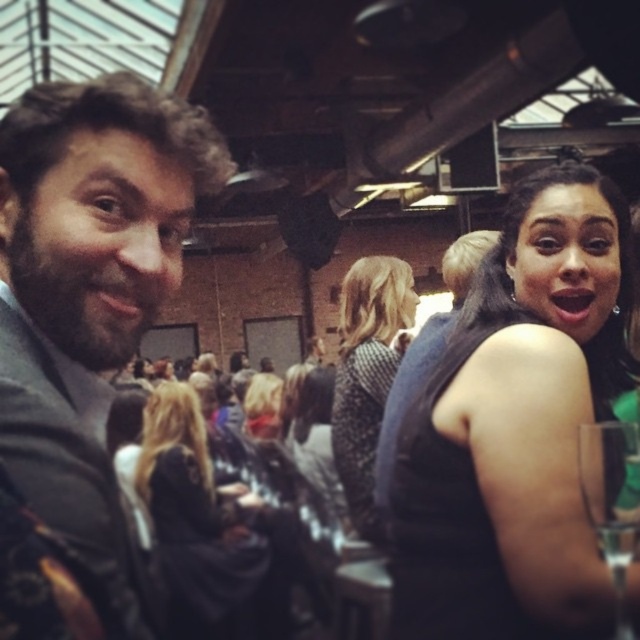
Who is taller, dark gray suit at left or black matte dress at upper right?

black matte dress at upper right

Does dark gray suit at left appear under black matte dress at upper right?

Actually, dark gray suit at left is above black matte dress at upper right.

The image size is (640, 640). What do you see at coordinates (83, 333) in the screenshot? I see `dark gray suit at left` at bounding box center [83, 333].

This screenshot has height=640, width=640. What are the coordinates of `dark gray suit at left` in the screenshot? It's located at (83, 333).

Between black matte dress at upper right and black fabric dress at upper right, which one is positioned lower?

Positioned lower is black matte dress at upper right.

In the scene shown: Who is more forward, (476, 433) or (410, 387)?

Point (476, 433) is in front.

At what (x,y) coordinates should I click in order to perform the action: click on black matte dress at upper right. Please return your answer as a coordinate pair (x, y). Image resolution: width=640 pixels, height=640 pixels. Looking at the image, I should click on (516, 426).

Does dark gray suit at left appear over clear glass wine glass at lower right?

Yes, dark gray suit at left is above clear glass wine glass at lower right.

Which is above, dark gray suit at left or clear glass wine glass at lower right?

dark gray suit at left is higher up.

Identify the location of dark gray suit at left. click(x=83, y=333).